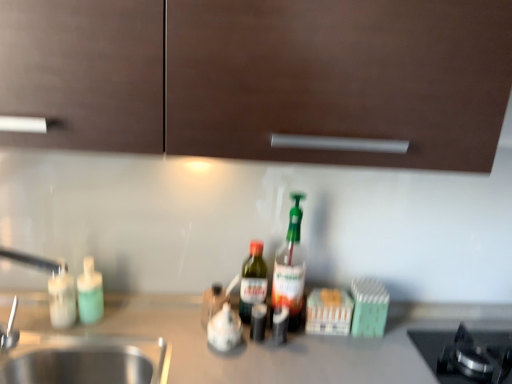
Question: Considering their positions, is matte green soap dispenser at left, which is the third bottle from right to left, located in front of or behind silver metallic faucet at left?

Choices:
 (A) front
 (B) behind

Answer: (B)

Question: Does point (96, 274) appear closer or farther from the camera than point (5, 332)?

Choices:
 (A) farther
 (B) closer

Answer: (A)

Question: Which of these objects is positioned closest to the green glass bottle at center, which is counted as the second bottle, starting from the right?

Choices:
 (A) silver metallic faucet at left
 (B) matte green soap dispenser at left, which appears as the 2th bottle when viewed from the left
 (C) white glossy soap dispenser at left, placed as the fourth bottle when sorted from right to left
 (D) translucent plastic bottle at center, the 4th bottle viewed from the left

Answer: (D)

Question: Which object is positioned farthest from the silver metallic faucet at left?

Choices:
 (A) white glossy soap dispenser at left, arranged as the first bottle when viewed from the left
 (B) matte green soap dispenser at left, which appears as the 2th bottle when viewed from the left
 (C) translucent plastic bottle at center, the first bottle in the right-to-left sequence
 (D) green glass bottle at center, the third bottle positioned from the left

Answer: (C)